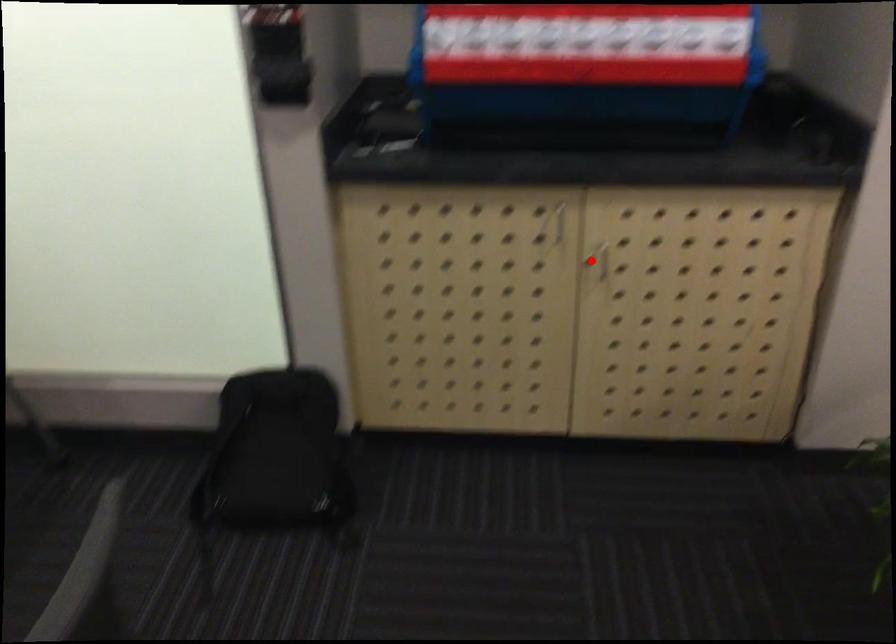
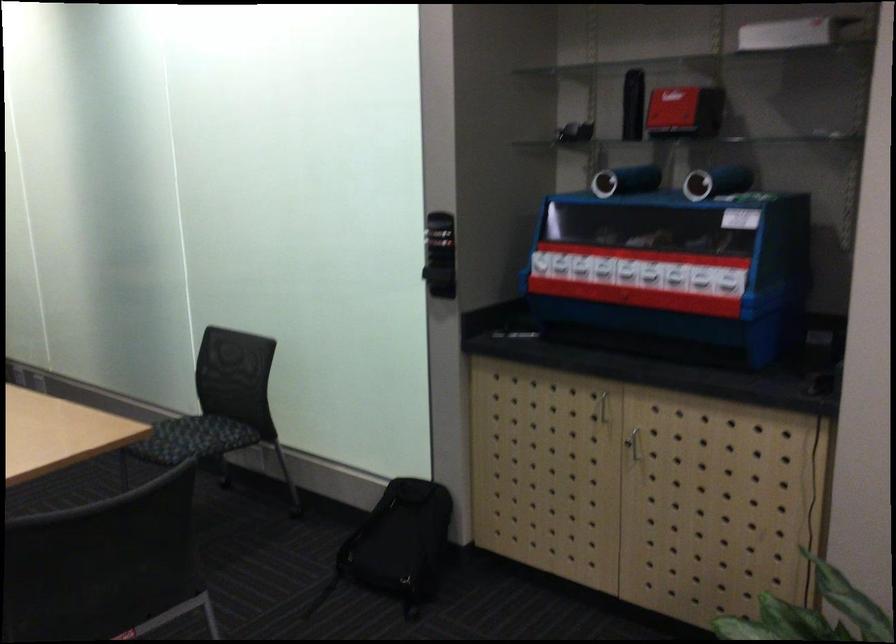
Question: I am providing you with two images of the same scene from different viewpoints. Given a red point in image1, look at the same physical point in image2. Is it:

Choices:
 (A) Closer to the viewpoint
 (B) Farther from the viewpoint

Answer: (B)